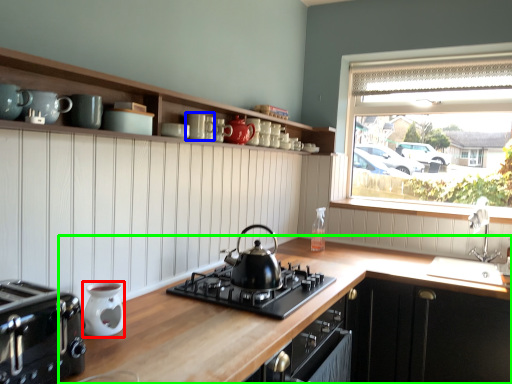
Question: Which is nearer to the kitchen appliance (highlighted by a red box)? mug (highlighted by a blue box) or countertop (highlighted by a green box).

Choices:
 (A) mug
 (B) countertop

Answer: (B)